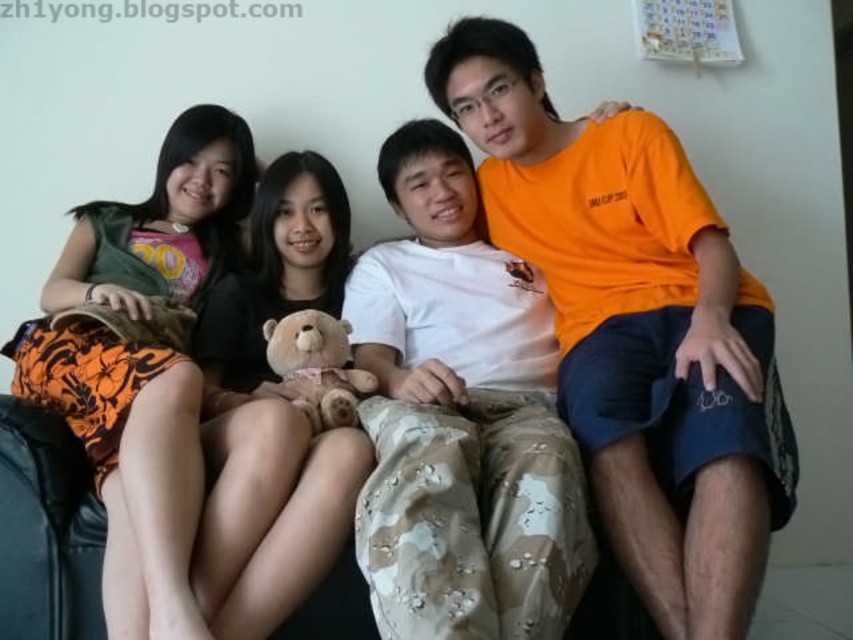
Question: Considering the real-world distances, which object is closest to the soft brown teddy bear at center?

Choices:
 (A) white cotton shirt at center
 (B) orange cotton t-shirt at center

Answer: (A)

Question: Does orange cotton t-shirt at center appear over white cotton shirt at center?

Choices:
 (A) no
 (B) yes

Answer: (B)

Question: Does white cotton shirt at center appear on the right side of soft brown teddy bear at center?

Choices:
 (A) yes
 (B) no

Answer: (A)

Question: Is orange cotton t-shirt at center bigger than soft brown teddy bear at center?

Choices:
 (A) yes
 (B) no

Answer: (A)

Question: Estimate the real-world distances between objects in this image. Which object is closer to the white cotton shirt at center?

Choices:
 (A) orange cotton t-shirt at center
 (B) soft brown plush at center

Answer: (B)

Question: Estimate the real-world distances between objects in this image. Which object is farther from the soft brown teddy bear at center?

Choices:
 (A) soft brown plush at center
 (B) white cotton shirt at center
 (C) orange cotton t-shirt at center

Answer: (C)